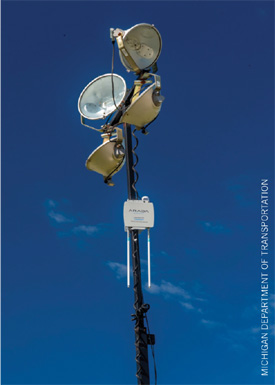
Find the location of a particular element. Image resolution: width=275 pixels, height=385 pixels. electric cord is located at coordinates (135, 164), (136, 308), (112, 75).